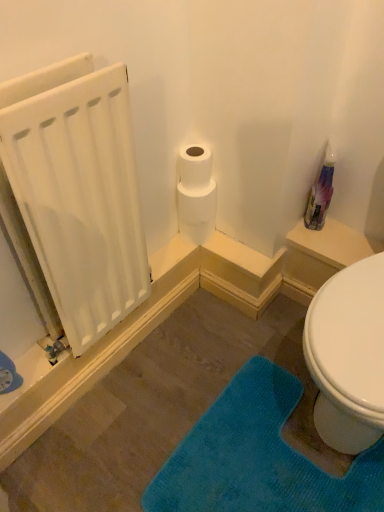
Question: Is white matte radiator at left far away from translucent plastic spray bottle at upper right?

Choices:
 (A) yes
 (B) no

Answer: (B)

Question: Is the position of white matte radiator at left less distant than that of translucent plastic spray bottle at upper right?

Choices:
 (A) no
 (B) yes

Answer: (B)

Question: From a real-world perspective, is white matte radiator at left located beneath translucent plastic spray bottle at upper right?

Choices:
 (A) no
 (B) yes

Answer: (A)

Question: Is white matte radiator at left to the right of translucent plastic spray bottle at upper right from the viewer's perspective?

Choices:
 (A) no
 (B) yes

Answer: (A)

Question: Could translucent plastic spray bottle at upper right be considered to be inside white matte radiator at left?

Choices:
 (A) yes
 (B) no

Answer: (B)

Question: Is white matte radiator at left taller or shorter than teal plush bath mat at lower right?

Choices:
 (A) short
 (B) tall

Answer: (B)

Question: Considering the positions of white matte radiator at left and teal plush bath mat at lower right in the image, is white matte radiator at left wider or thinner than teal plush bath mat at lower right?

Choices:
 (A) wide
 (B) thin

Answer: (B)

Question: Considering the positions of point (16, 120) and point (177, 453), is point (16, 120) closer or farther from the camera than point (177, 453)?

Choices:
 (A) farther
 (B) closer

Answer: (B)

Question: Is white matte radiator at left in front of or behind teal plush bath mat at lower right in the image?

Choices:
 (A) front
 (B) behind

Answer: (A)

Question: From the image's perspective, is translucent plastic spray bottle at upper right positioned above or below white matte toilet paper at upper center?

Choices:
 (A) below
 (B) above

Answer: (B)

Question: Considering the positions of translucent plastic spray bottle at upper right and white matte toilet paper at upper center in the image, is translucent plastic spray bottle at upper right wider or thinner than white matte toilet paper at upper center?

Choices:
 (A) thin
 (B) wide

Answer: (A)

Question: Is translucent plastic spray bottle at upper right spatially inside white matte toilet paper at upper center, or outside of it?

Choices:
 (A) inside
 (B) outside

Answer: (B)

Question: In terms of size, does translucent plastic spray bottle at upper right appear bigger or smaller than white matte toilet paper at upper center?

Choices:
 (A) big
 (B) small

Answer: (B)

Question: Is translucent plastic spray bottle at upper right inside or outside of teal plush bath mat at lower right?

Choices:
 (A) inside
 (B) outside

Answer: (B)

Question: Considering the positions of translucent plastic spray bottle at upper right and teal plush bath mat at lower right in the image, is translucent plastic spray bottle at upper right taller or shorter than teal plush bath mat at lower right?

Choices:
 (A) short
 (B) tall

Answer: (B)